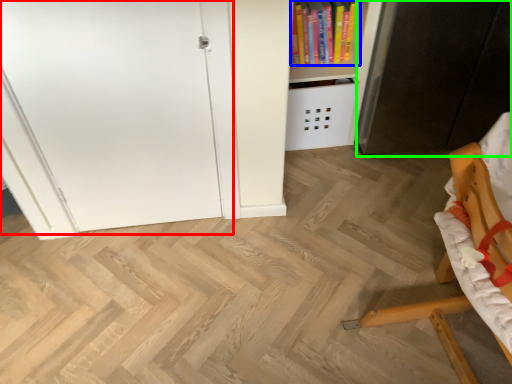
Question: Considering the real-world distances, which object is closest to door (highlighted by a red box)? book (highlighted by a blue box) or cabinetry (highlighted by a green box).

Choices:
 (A) book
 (B) cabinetry

Answer: (A)